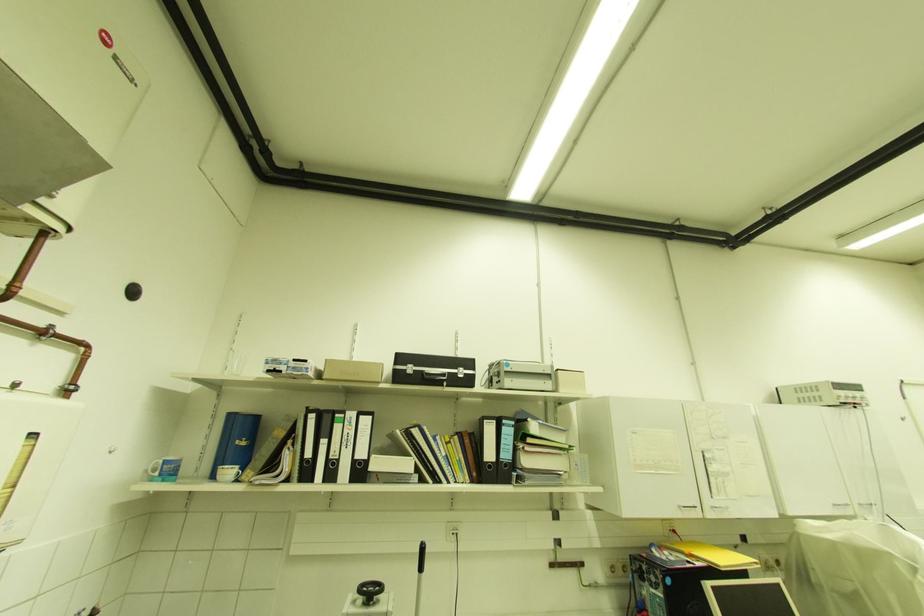
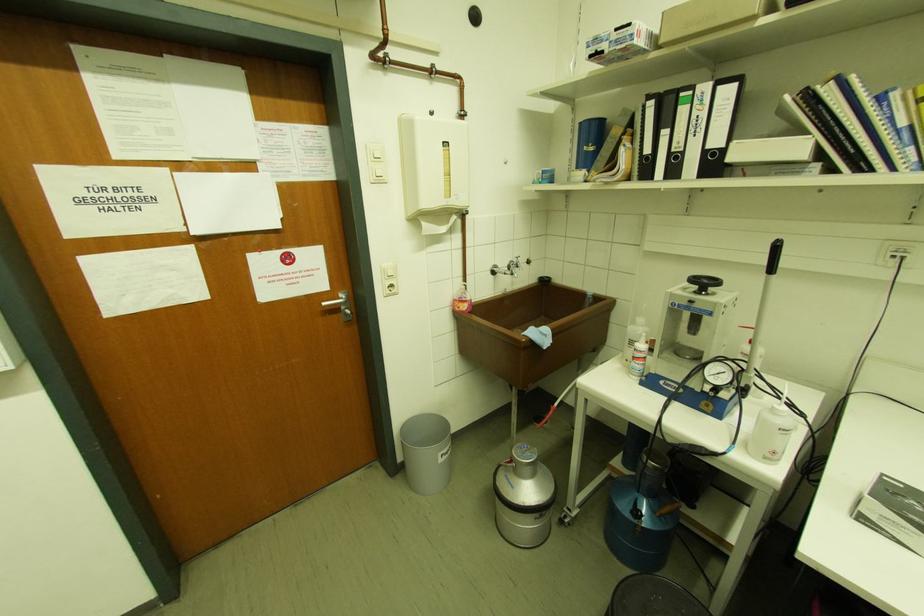
Where in the second image is the point corresponding to [309,459] from the first image?

(648, 155)